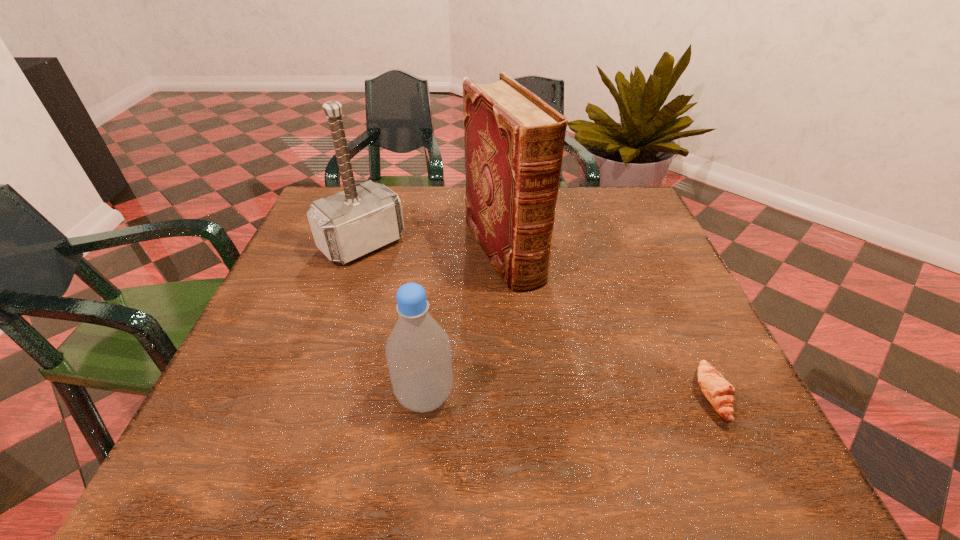
Find the location of a particular element. The height and width of the screenshot is (540, 960). free space in the image that satisfies the following two spatial constraints: 1. on the front side of the hardback book; 2. on the front-facing side of the shortest object is located at coordinates (514, 396).